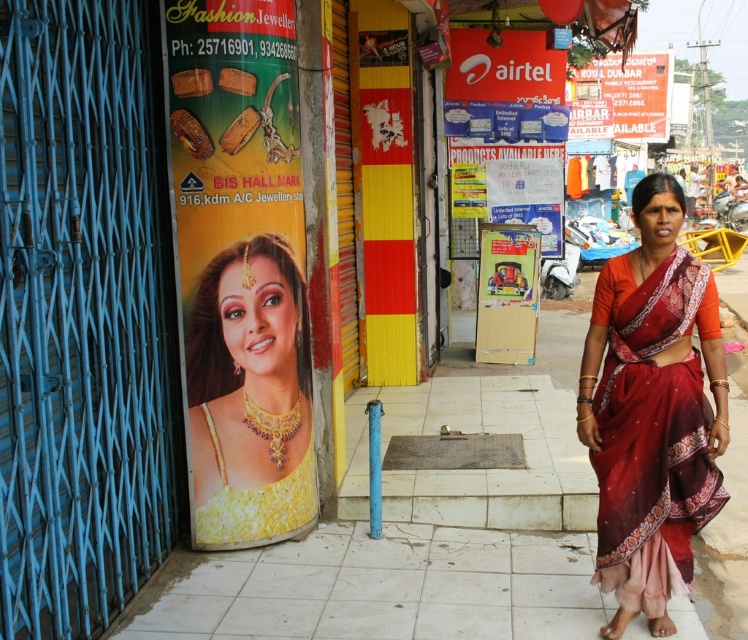
You are a photographer trying to capture the yellow satin dress at center without the silky red sari at right blocking it. Can you adjust your position to frame the dress without the sari appearing in the shot?

The silky red sari at right is positioned over the yellow satin dress at center, so adjusting your position might not hide the sari completely. However, moving to the left side could minimize its visibility.

Based on the scene described, can you determine which object is taller between the yellow fabric poster at left and the silky red sari at right?

The yellow fabric poster at left is much taller than the silky red sari at right.